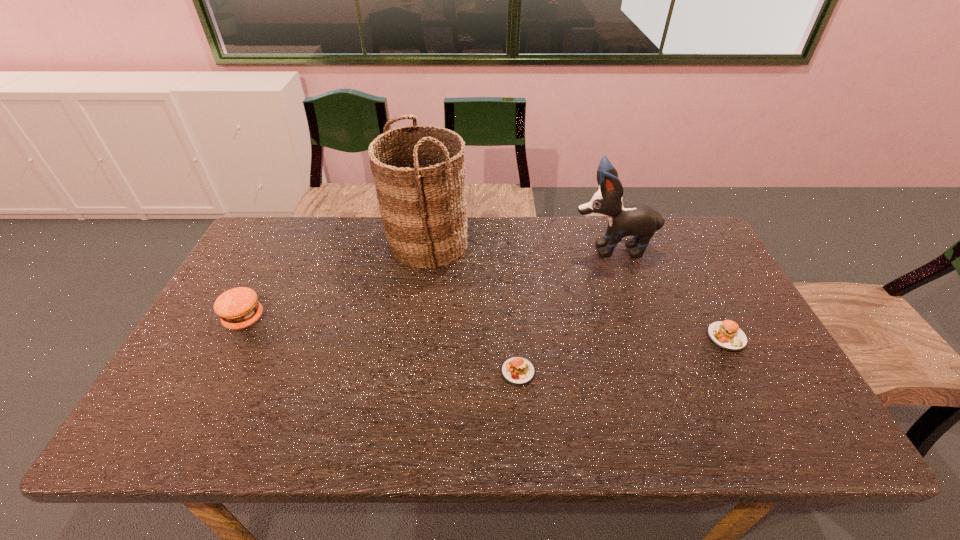
Identify the location of basket. tap(422, 206).

Identify the location of the tallest object. (422, 206).

I want to click on the fourth object from left to right, so click(x=639, y=220).

In order to click on the second tallest object in this screenshot , I will do `click(639, 220)`.

The height and width of the screenshot is (540, 960). Find the location of `the third tallest object`. the third tallest object is located at coordinates (238, 308).

The width and height of the screenshot is (960, 540). What are the coordinates of `the leftmost object` in the screenshot? It's located at (238, 308).

Where is `the fourth tallest object`? The width and height of the screenshot is (960, 540). the fourth tallest object is located at coordinates (726, 334).

The height and width of the screenshot is (540, 960). I want to click on the rightmost patty (food), so click(x=726, y=334).

This screenshot has height=540, width=960. I want to click on the shortest patty (food), so click(x=519, y=371).

Identify the location of the third object from left to right. (519, 371).